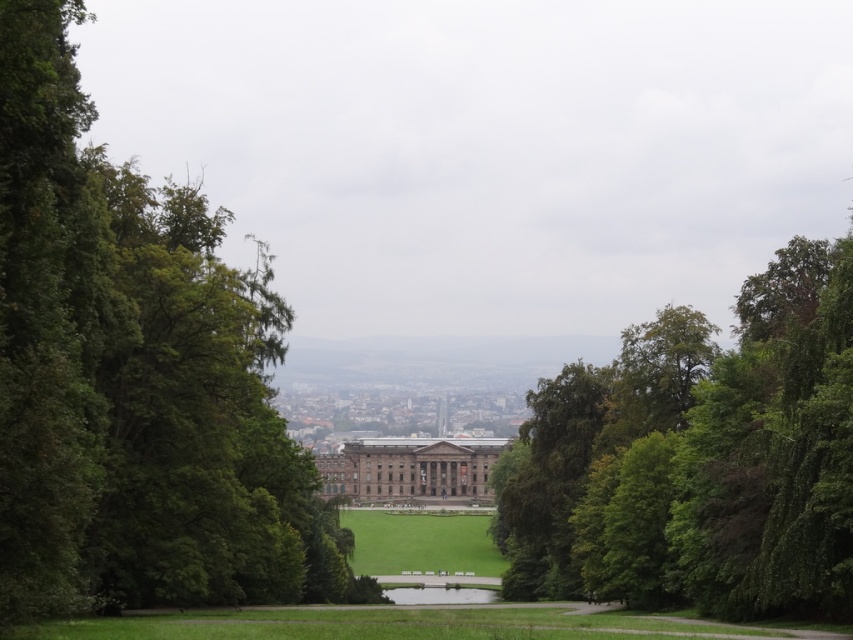
Question: Which of the following is the closest to the observer?

Choices:
 (A) green leafy tree at left
 (B) green leafy tree at center
 (C) brown stone palace at center

Answer: (A)

Question: Considering the real-world distances, which object is closest to the brown stone palace at center?

Choices:
 (A) green leafy tree at left
 (B) green leafy tree at center

Answer: (B)

Question: Is green leafy tree at left positioned before brown stone palace at center?

Choices:
 (A) yes
 (B) no

Answer: (A)

Question: Can you confirm if green leafy tree at left is wider than brown stone palace at center?

Choices:
 (A) no
 (B) yes

Answer: (A)

Question: Considering the relative positions of green leafy tree at center and brown stone palace at center in the image provided, where is green leafy tree at center located with respect to brown stone palace at center?

Choices:
 (A) below
 (B) above

Answer: (B)

Question: Which object is the farthest from the green leafy tree at left?

Choices:
 (A) brown stone palace at center
 (B) green leafy tree at center

Answer: (A)